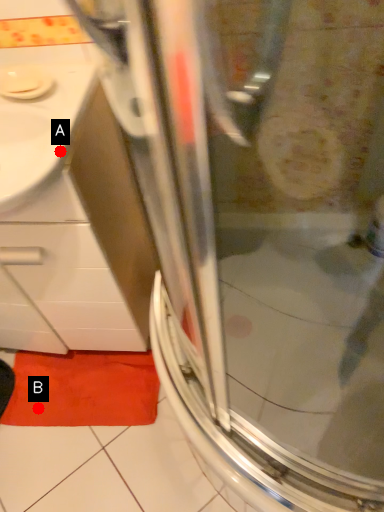
Question: Two points are circled on the image, labeled by A and B beside each circle. Which point appears closest to the camera in this image?

Choices:
 (A) A is closer
 (B) B is closer

Answer: (A)